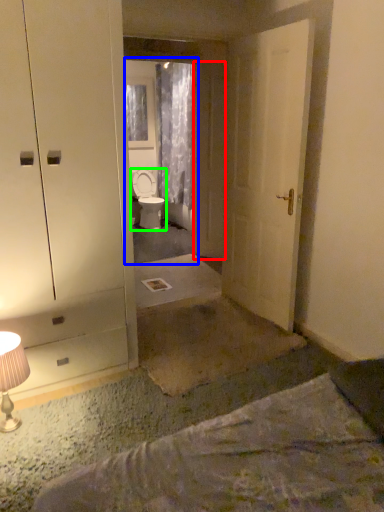
Question: Estimate the real-world distances between objects in this image. Which object is closer to door (highlighted by a red box), mirror (highlighted by a blue box) or toilet (highlighted by a green box)?

Choices:
 (A) mirror
 (B) toilet

Answer: (A)